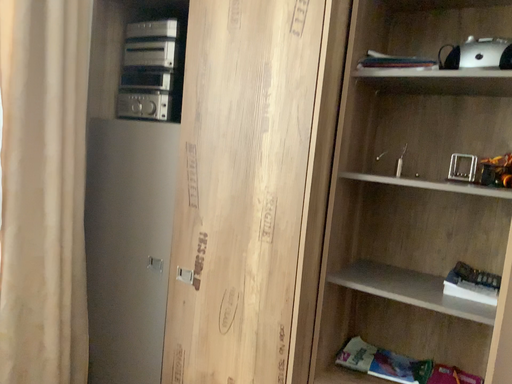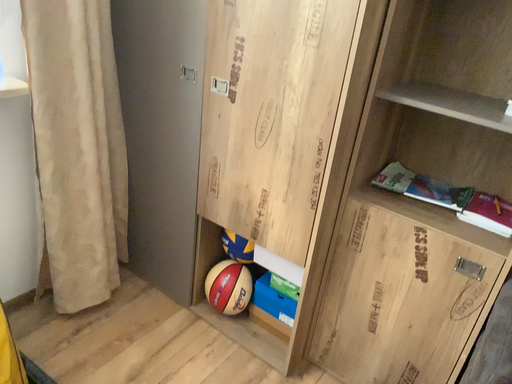
Question: Which way did the camera rotate in the video?

Choices:
 (A) rotated upward
 (B) rotated downward

Answer: (B)